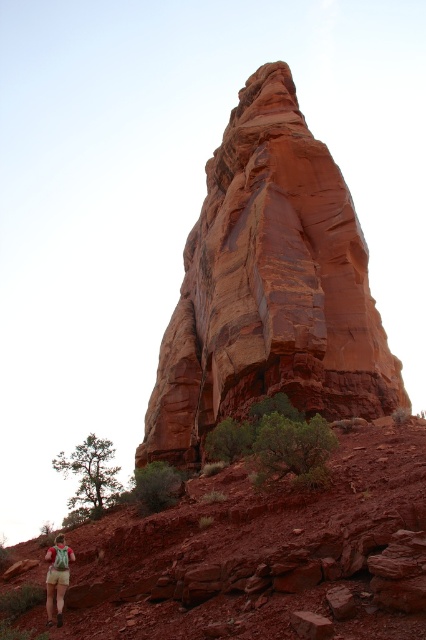
Is point (256, 88) farther from camera compared to point (69, 541)?

Yes, point (256, 88) is farther from viewer.

Who is positioned more to the right, rustic sandstone rock formation at center or reddish-brown rock at center?

From the viewer's perspective, rustic sandstone rock formation at center appears more on the right side.

What are the coordinates of `rustic sandstone rock formation at center` in the screenshot? It's located at (270, 285).

The image size is (426, 640). What do you see at coordinates (270, 285) in the screenshot? I see `rustic sandstone rock formation at center` at bounding box center [270, 285].

The width and height of the screenshot is (426, 640). Identify the location of rustic sandstone rock formation at center. (270, 285).

Can you confirm if reddish-brown rock at center is thinner than khaki shorts at lower left?

No.

Does reddish-brown rock at center lie in front of khaki shorts at lower left?

That is True.

Between point (388, 522) and point (65, 552), which one is positioned behind?

Positioned behind is point (65, 552).

At what (x,y) coordinates should I click in order to perform the action: click on reddish-brown rock at center. Please return your answer as a coordinate pair (x, y). The height and width of the screenshot is (640, 426). Looking at the image, I should click on (253, 552).